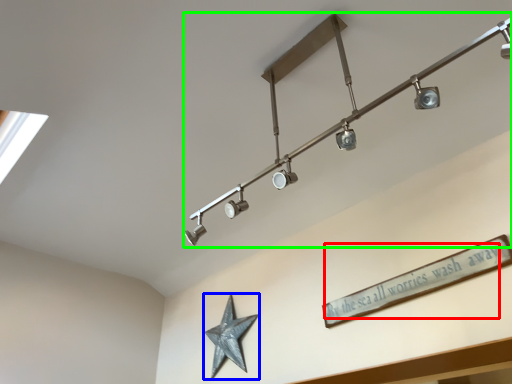
Question: Estimate the real-world distances between objects in this image. Which object is farther from writing (highlighted by a red box), star (highlighted by a blue box) or lamp (highlighted by a green box)?

Choices:
 (A) star
 (B) lamp

Answer: (A)